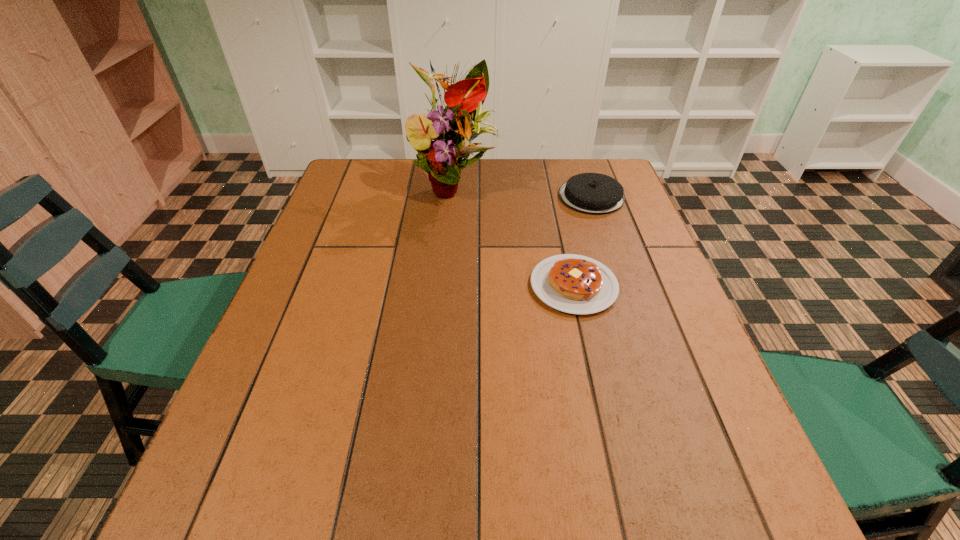
Locate an element on the screen. This screenshot has height=540, width=960. free spot between the farther pancake and the tallest object is located at coordinates (523, 191).

Find the location of a particular element. free point between the taller pancake and the shortest object is located at coordinates pos(583,241).

The width and height of the screenshot is (960, 540). In order to click on vacant space that is in between the second tallest object and the tallest object in this screenshot , I will do `click(523, 191)`.

Locate an element on the screen. The width and height of the screenshot is (960, 540). free point between the shortest object and the second shortest object is located at coordinates (583, 241).

The image size is (960, 540). Find the location of `vacant region between the farther pancake and the tallest object`. vacant region between the farther pancake and the tallest object is located at coordinates (523, 191).

The width and height of the screenshot is (960, 540). Find the location of `free spot between the tallest object and the nearest object`. free spot between the tallest object and the nearest object is located at coordinates (515, 235).

Choose which object is the nearest neighbor to the leftmost object. Please provide its 2D coordinates. Your answer should be formatted as a tuple, i.e. [(x, y)], where the tuple contains the x and y coordinates of a point satisfying the conditions above.

[(591, 193)]

Select which object appears as the closest to the leftmost object. Please provide its 2D coordinates. Your answer should be formatted as a tuple, i.e. [(x, y)], where the tuple contains the x and y coordinates of a point satisfying the conditions above.

[(591, 193)]

At what (x,y) coordinates should I click in order to perform the action: click on free space that satisfies the following two spatial constraints: 1. on the front-facing side of the bouquet; 2. on the left side of the farther pancake. Please return your answer as a coordinate pair (x, y). This screenshot has width=960, height=540. Looking at the image, I should click on (454, 197).

What are the coordinates of `vacant area in the image that satisfies the following two spatial constraints: 1. on the front-facing side of the leftmost object; 2. on the right side of the farther pancake` in the screenshot? It's located at (454, 197).